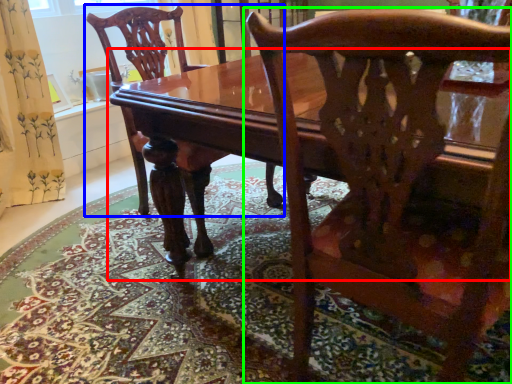
Question: Which object is the closest to the table (highlighted by a red box)? Choose among these: chair (highlighted by a blue box) or chair (highlighted by a green box).

Choices:
 (A) chair
 (B) chair

Answer: (B)